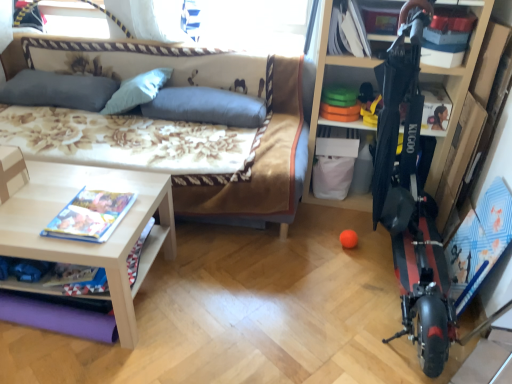
Question: Can gray fabric pillow at upper center, the second pillow from the right, be found inside blue fabric pillow at center, the 1th pillow from the right?

Choices:
 (A) yes
 (B) no

Answer: (B)

Question: Does blue fabric pillow at center, the 1th pillow from the right, turn towards gray fabric pillow at upper center, which is the 2th pillow from left to right?

Choices:
 (A) no
 (B) yes

Answer: (A)

Question: Does blue fabric pillow at center, the 1th pillow from the right, have a larger size compared to gray fabric pillow at upper center, the second pillow from the right?

Choices:
 (A) yes
 (B) no

Answer: (A)

Question: Are blue fabric pillow at center, which is counted as the third pillow, starting from the left, and gray fabric pillow at upper center, which is the 2th pillow from left to right, making contact?

Choices:
 (A) yes
 (B) no

Answer: (B)

Question: Is blue fabric pillow at center, which is counted as the third pillow, starting from the left, positioned beyond the bounds of gray fabric pillow at upper center, the second pillow from the right?

Choices:
 (A) no
 (B) yes

Answer: (B)

Question: Would you consider blue fabric pillow at center, which is counted as the third pillow, starting from the left, to be distant from gray fabric pillow at upper center, the second pillow from the right?

Choices:
 (A) yes
 (B) no

Answer: (B)

Question: Considering the relative positions of gray fabric pillow at upper left, marked as the first pillow in a left-to-right arrangement, and floral fabric studio couch at center in the image provided, is gray fabric pillow at upper left, marked as the first pillow in a left-to-right arrangement, behind floral fabric studio couch at center?

Choices:
 (A) yes
 (B) no

Answer: (A)

Question: From the image's perspective, is gray fabric pillow at upper left, marked as the third pillow in a right-to-left arrangement, beneath floral fabric studio couch at center?

Choices:
 (A) yes
 (B) no

Answer: (B)

Question: Are gray fabric pillow at upper left, marked as the third pillow in a right-to-left arrangement, and floral fabric studio couch at center beside each other?

Choices:
 (A) no
 (B) yes

Answer: (A)

Question: Is gray fabric pillow at upper left, marked as the first pillow in a left-to-right arrangement, smaller than floral fabric studio couch at center?

Choices:
 (A) no
 (B) yes

Answer: (B)

Question: Considering the relative sizes of gray fabric pillow at upper left, marked as the first pillow in a left-to-right arrangement, and floral fabric studio couch at center in the image provided, is gray fabric pillow at upper left, marked as the first pillow in a left-to-right arrangement, wider than floral fabric studio couch at center?

Choices:
 (A) yes
 (B) no

Answer: (B)

Question: Can you confirm if gray fabric pillow at upper left, marked as the first pillow in a left-to-right arrangement, is thinner than floral fabric studio couch at center?

Choices:
 (A) yes
 (B) no

Answer: (A)

Question: Does gray fabric pillow at upper left, marked as the first pillow in a left-to-right arrangement, have a smaller size compared to gray fabric pillow at upper center, the second pillow from the right?

Choices:
 (A) yes
 (B) no

Answer: (A)